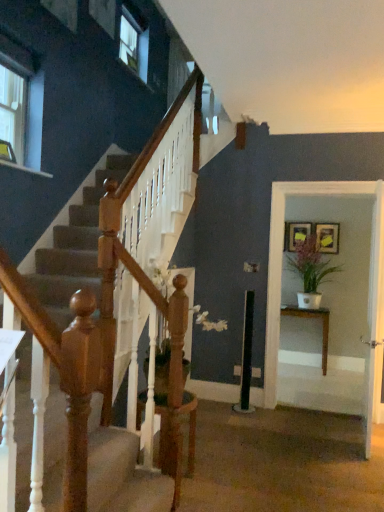
Question: Considering the relative sizes of green matte plant at right and matte gold picture frame at upper right, the 2th picture frame in the right-to-left sequence, in the image provided, is green matte plant at right bigger than matte gold picture frame at upper right, the 2th picture frame in the right-to-left sequence,?

Choices:
 (A) no
 (B) yes

Answer: (B)

Question: Does green matte plant at right have a greater height compared to matte gold picture frame at upper right, the 2th picture frame in the right-to-left sequence?

Choices:
 (A) yes
 (B) no

Answer: (A)

Question: Is green matte plant at right in contact with matte gold picture frame at upper right, the 2th picture frame in the right-to-left sequence?

Choices:
 (A) no
 (B) yes

Answer: (A)

Question: Does green matte plant at right turn towards matte gold picture frame at upper right, the 2th picture frame in the right-to-left sequence?

Choices:
 (A) yes
 (B) no

Answer: (B)

Question: Is green matte plant at right shorter than matte gold picture frame at upper right, which is the first picture frame in left-to-right order?

Choices:
 (A) no
 (B) yes

Answer: (A)

Question: In terms of width, does wooden table at right look wider or thinner when compared to matte gold picture frame at upper right, which is the first picture frame in left-to-right order?

Choices:
 (A) wide
 (B) thin

Answer: (A)

Question: Based on their sizes in the image, would you say wooden table at right is bigger or smaller than matte gold picture frame at upper right, which is the first picture frame in left-to-right order?

Choices:
 (A) small
 (B) big

Answer: (B)

Question: Is wooden table at right taller or shorter than matte gold picture frame at upper right, which is the first picture frame in left-to-right order?

Choices:
 (A) short
 (B) tall

Answer: (B)

Question: Considering the relative positions of wooden table at right and matte gold picture frame at upper right, which is the first picture frame in left-to-right order, in the image provided, is wooden table at right to the left or to the right of matte gold picture frame at upper right, which is the first picture frame in left-to-right order,?

Choices:
 (A) right
 (B) left

Answer: (B)

Question: Looking at their shapes, would you say white glossy door at center is wider or thinner than wooden picture frame at upper right, which is the second picture frame from left to right?

Choices:
 (A) thin
 (B) wide

Answer: (B)

Question: Considering the positions of point (379, 272) and point (331, 227), is point (379, 272) closer or farther from the camera than point (331, 227)?

Choices:
 (A) farther
 (B) closer

Answer: (B)

Question: Considering the positions of white glossy door at center and wooden picture frame at upper right, which is the second picture frame from left to right, in the image, is white glossy door at center taller or shorter than wooden picture frame at upper right, which is the second picture frame from left to right,?

Choices:
 (A) short
 (B) tall

Answer: (B)

Question: Relative to wooden picture frame at upper right, positioned as the 1th picture frame in right-to-left order, is white glossy door at center in front or behind?

Choices:
 (A) front
 (B) behind

Answer: (A)

Question: Is white glossy door at center inside the boundaries of white glossy table at right, or outside?

Choices:
 (A) inside
 (B) outside

Answer: (B)

Question: In terms of width, does white glossy door at center look wider or thinner when compared to white glossy table at right?

Choices:
 (A) thin
 (B) wide

Answer: (A)